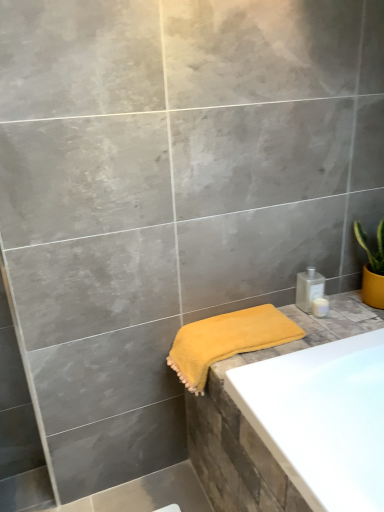
I want to click on unoccupied region to the right of white glossy soap dispenser at upper right, the second toiletry positioned from the top, so click(x=351, y=311).